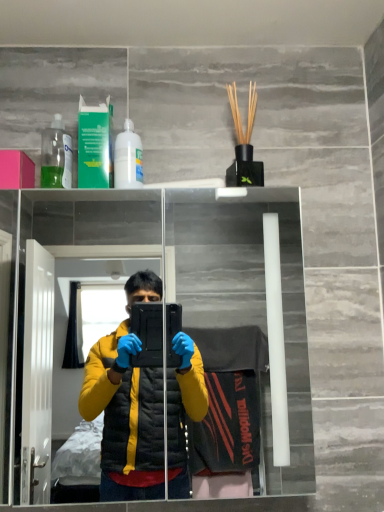
Question: Is pink matte box at upper left taller than green plastic mouthwash at upper left?

Choices:
 (A) no
 (B) yes

Answer: (A)

Question: From the image's perspective, does pink matte box at upper left appear lower than green plastic mouthwash at upper left?

Choices:
 (A) yes
 (B) no

Answer: (A)

Question: Is pink matte box at upper left at the left side of green plastic mouthwash at upper left?

Choices:
 (A) yes
 (B) no

Answer: (A)

Question: From the image's perspective, is pink matte box at upper left above green plastic mouthwash at upper left?

Choices:
 (A) yes
 (B) no

Answer: (B)

Question: Is pink matte box at upper left shorter than green plastic mouthwash at upper left?

Choices:
 (A) yes
 (B) no

Answer: (A)

Question: Can you confirm if pink matte box at upper left is smaller than green plastic mouthwash at upper left?

Choices:
 (A) no
 (B) yes

Answer: (A)

Question: From the image's perspective, is white glossy bottle at upper center, the first bottle viewed from the right, located beneath transparent plastic bottle at upper left, placed as the first bottle when sorted from left to right?

Choices:
 (A) yes
 (B) no

Answer: (A)

Question: Does white glossy bottle at upper center, the first bottle viewed from the right, appear on the left side of transparent plastic bottle at upper left, the second bottle viewed from the right?

Choices:
 (A) yes
 (B) no

Answer: (B)

Question: Considering the relative sizes of white glossy bottle at upper center, the first bottle viewed from the right, and transparent plastic bottle at upper left, placed as the first bottle when sorted from left to right, in the image provided, is white glossy bottle at upper center, the first bottle viewed from the right, wider than transparent plastic bottle at upper left, placed as the first bottle when sorted from left to right,?

Choices:
 (A) yes
 (B) no

Answer: (A)

Question: Is white glossy bottle at upper center, the second bottle positioned from the left, behind transparent plastic bottle at upper left, the second bottle viewed from the right?

Choices:
 (A) no
 (B) yes

Answer: (A)

Question: Is there a large distance between white glossy bottle at upper center, the first bottle viewed from the right, and transparent plastic bottle at upper left, placed as the first bottle when sorted from left to right?

Choices:
 (A) no
 (B) yes

Answer: (A)

Question: Considering the relative sizes of white glossy bottle at upper center, the second bottle positioned from the left, and transparent plastic bottle at upper left, the second bottle viewed from the right, in the image provided, is white glossy bottle at upper center, the second bottle positioned from the left, smaller than transparent plastic bottle at upper left, the second bottle viewed from the right,?

Choices:
 (A) no
 (B) yes

Answer: (B)

Question: Is green plastic mouthwash at upper left at the left side of transparent glass mirror at upper center?

Choices:
 (A) yes
 (B) no

Answer: (A)